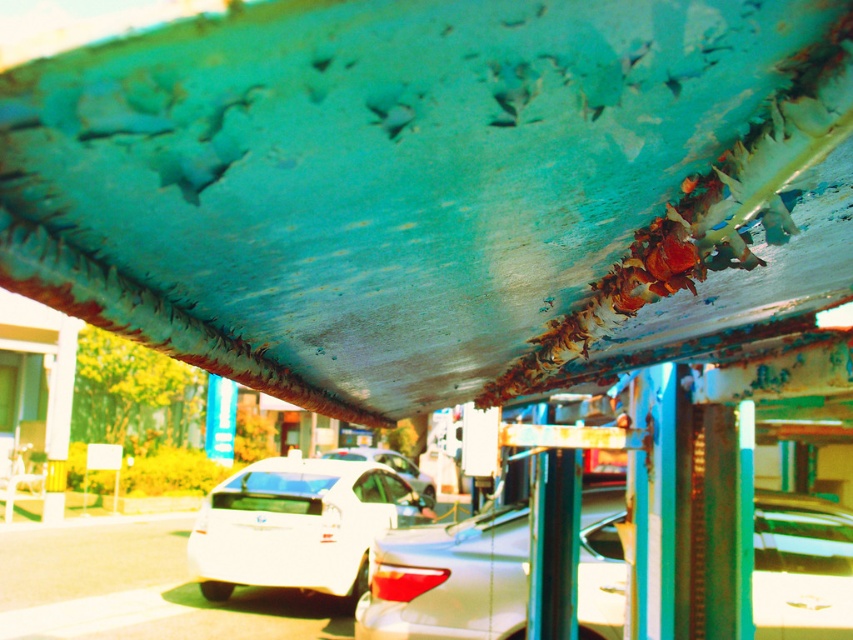
You are standing at the point with coordinates point (x=289, y=582) and want to move towards point (x=428, y=502). Will you be moving forward or backward relative to your current position?

Since point (x=289, y=582) is in front of point (x=428, y=502), moving towards point (x=428, y=502) would mean moving backward relative to your current position.

You are a parking attendant trying to fit a car that is 1.5 meters tall into a parking spot. You see the satin white sedan at center and the shiny white car at center. Which car can the new car fit under if there is a low hanging branch above the parking spot?

The satin white sedan at center has a lesser height compared to the shiny white car at center, so the new car can fit under the low hanging branch if it is parked where the satin white sedan at center is currently positioned.